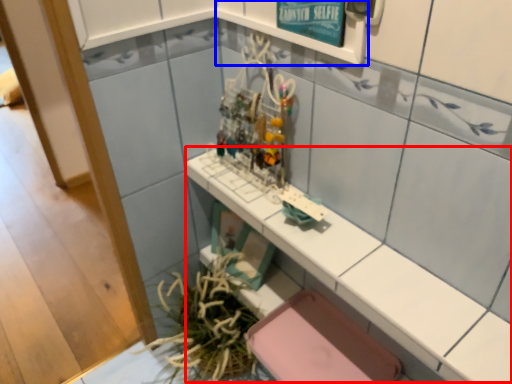
Question: Which object is further to the camera taking this photo, counter top (highlighted by a red box) or shelf (highlighted by a blue box)?

Choices:
 (A) counter top
 (B) shelf

Answer: (B)